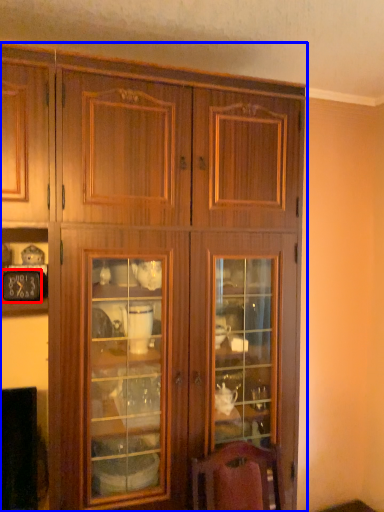
Question: Which of the following is the farthest to the observer, clock (highlighted by a red box) or cupboard (highlighted by a blue box)?

Choices:
 (A) clock
 (B) cupboard

Answer: (A)